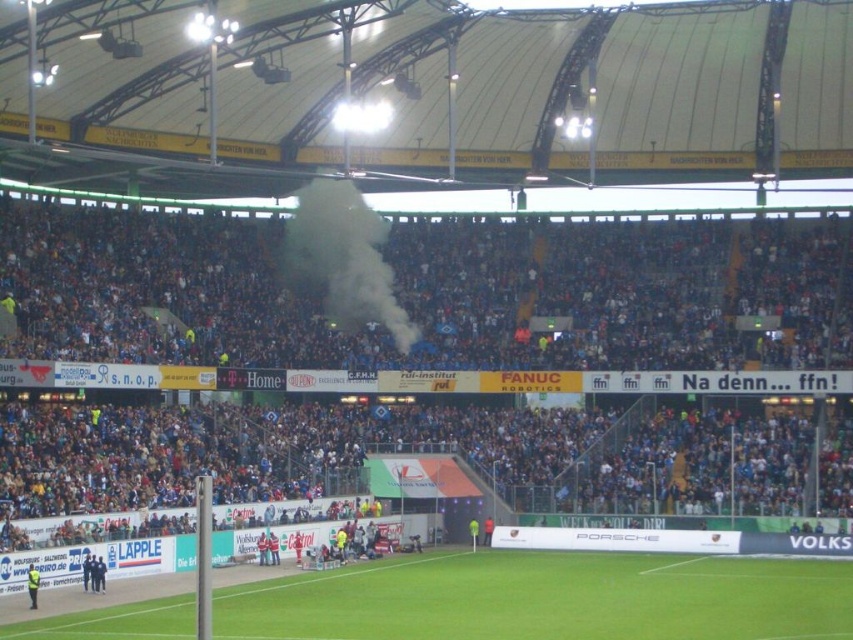
Is green grass football field at center shorter than white smoke at center?

Yes, green grass football field at center is shorter than white smoke at center.

Can you confirm if green grass football field at center is positioned to the right of white smoke at center?

Correct, you'll find green grass football field at center to the right of white smoke at center.

Which is behind, point (787, 598) or point (349, 227)?

The point (349, 227) is behind.

This screenshot has width=853, height=640. I want to click on green grass football field at center, so click(x=547, y=598).

Between blue fabric crowd at upper center and white smoke at center, which one has less height?

white smoke at center

Between point (209, 445) and point (320, 284), which one is positioned in front?

Point (209, 445)

Locate an element on the screen. The image size is (853, 640). blue fabric crowd at upper center is located at coordinates (428, 296).

Consider the image. Who is more distant from viewer, (729,353) or (784,628)?

Positioned behind is point (729,353).

Is the position of blue fabric crowd at upper center less distant than that of green grass football field at center?

No, it is not.

Who is more forward, (843,314) or (544,577)?

Point (544,577) is in front.

Where is `blue fabric crowd at upper center`? This screenshot has height=640, width=853. blue fabric crowd at upper center is located at coordinates [x=428, y=296].